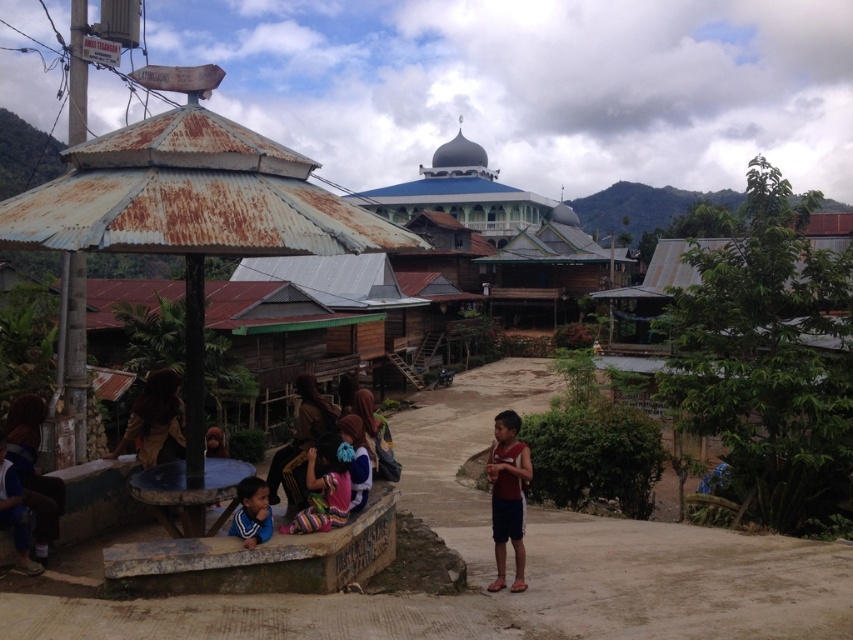
Which is more to the left, reddish-brown fabric shorts at center or striped fabric dress at lower center?

striped fabric dress at lower center

Which is behind, point (500, 579) or point (315, 524)?

Point (500, 579)

You are a GUI agent. You are given a task and a screenshot of the screen. Output one action in this format:
    pyautogui.click(x=<x>, y=<y>)
    Task: Click on the reddish-brown fabric shorts at center
    The image size is (853, 640).
    Given the screenshot: What is the action you would take?
    pyautogui.click(x=508, y=496)

Between brown fabric at lower left and brown fabric shirt at lower left, which one appears on the left side from the viewer's perspective?

brown fabric at lower left

Does brown fabric at lower left appear under brown fabric shirt at lower left?

Incorrect, brown fabric at lower left is not positioned below brown fabric shirt at lower left.

The width and height of the screenshot is (853, 640). What do you see at coordinates (155, 420) in the screenshot?
I see `brown fabric at lower left` at bounding box center [155, 420].

Locate an element on the screen. The image size is (853, 640). brown fabric at lower left is located at coordinates (155, 420).

The image size is (853, 640). In order to click on reddish-brown fabric shorts at center in this screenshot , I will do `click(508, 496)`.

Does reddish-brown fabric shorts at center appear over brown fabric shirt at lower left?

Actually, reddish-brown fabric shorts at center is below brown fabric shirt at lower left.

Who is more distant from viewer, (502,557) or (206,435)?

Point (206,435)

The width and height of the screenshot is (853, 640). In order to click on reddish-brown fabric shorts at center in this screenshot , I will do `click(508, 496)`.